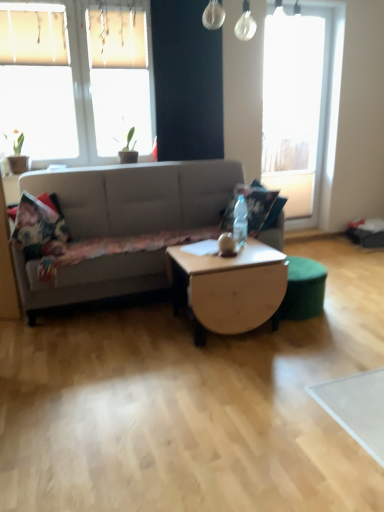
Question: Is translucent glass bottle at center further to camera compared to fluffy floral pillow at left, the 2th pillow from the right?

Choices:
 (A) no
 (B) yes

Answer: (A)

Question: Would you say translucent glass bottle at center contains fluffy floral pillow at left, which is the first pillow in left-to-right order?

Choices:
 (A) yes
 (B) no

Answer: (B)

Question: Is translucent glass bottle at center bigger than fluffy floral pillow at left, which is the first pillow in left-to-right order?

Choices:
 (A) yes
 (B) no

Answer: (B)

Question: From a real-world perspective, is translucent glass bottle at center positioned under fluffy floral pillow at left, the 2th pillow from the right, based on gravity?

Choices:
 (A) yes
 (B) no

Answer: (B)

Question: Are translucent glass bottle at center and fluffy floral pillow at left, which is the first pillow in left-to-right order, located far from each other?

Choices:
 (A) yes
 (B) no

Answer: (A)

Question: Can you confirm if translucent glass bottle at center is positioned to the left of fluffy floral pillow at left, the 2th pillow from the right?

Choices:
 (A) no
 (B) yes

Answer: (A)

Question: From a real-world perspective, does white fabric window at upper left, acting as the 2th window starting from the right, stand above green matte plant at upper left?

Choices:
 (A) yes
 (B) no

Answer: (A)

Question: Is white fabric window at upper left, marked as the second window in a back-to-front arrangement, facing away from green matte plant at upper left?

Choices:
 (A) no
 (B) yes

Answer: (B)

Question: Is white fabric window at upper left, marked as the second window in a back-to-front arrangement, wider than green matte plant at upper left?

Choices:
 (A) yes
 (B) no

Answer: (B)

Question: Does white fabric window at upper left, acting as the 2th window starting from the right, turn towards green matte plant at upper left?

Choices:
 (A) no
 (B) yes

Answer: (B)

Question: Is the position of white fabric window at upper left, acting as the 2th window starting from the right, less distant than that of green matte plant at upper left?

Choices:
 (A) no
 (B) yes

Answer: (B)

Question: From a real-world perspective, is white fabric window at upper left, acting as the 2th window starting from the right, physically below green matte plant at upper left?

Choices:
 (A) yes
 (B) no

Answer: (B)

Question: Can you confirm if transparent glass window at upper right, which is the 1th window in back-to-front order, is taller than fluffy floral pillow at center, the 2th pillow from the left?

Choices:
 (A) no
 (B) yes

Answer: (B)